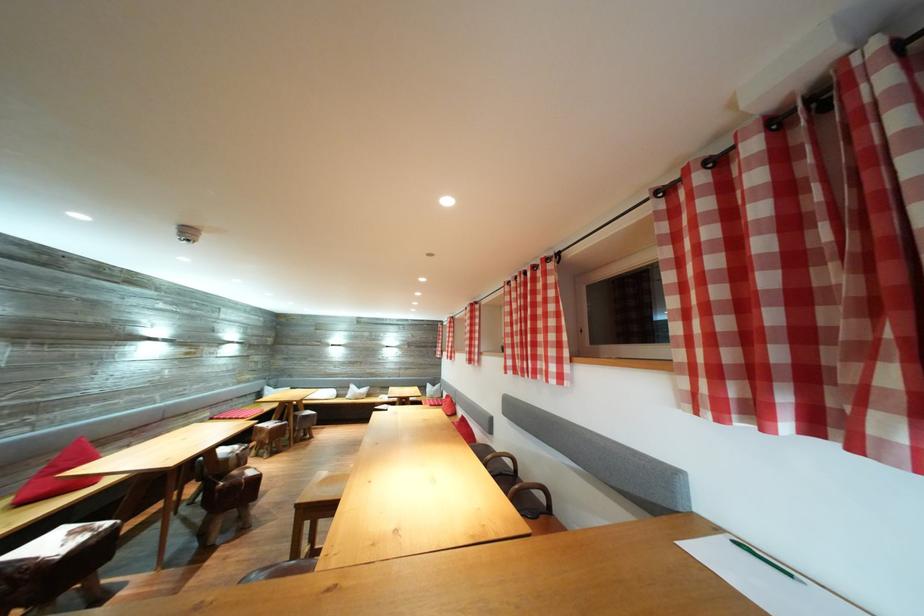
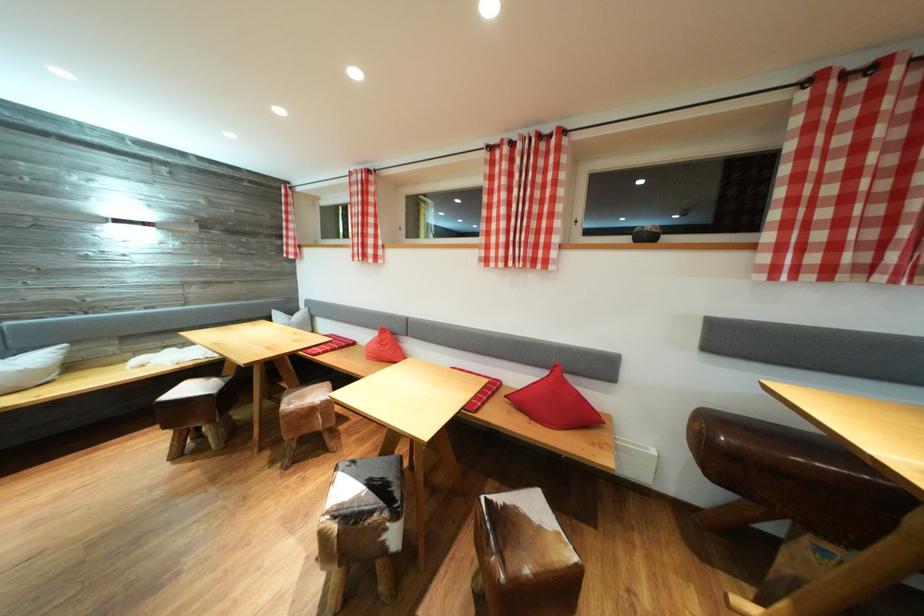
Find the pixel in the second image that matches pixel 367 392 in the first image.

(14, 358)